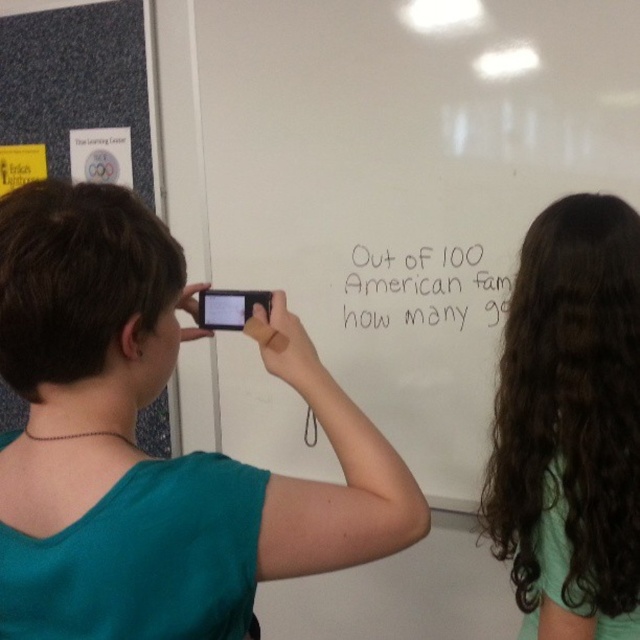
You are a photographer positioned in front of the whiteboard. You need to capture a clear image of the text on the whiteboard while also including the person with dark brown curly hair at upper right in the frame. Given their distance from you, will you need to adjust your camera angle to include both the text and the person?

The dark brown curly hair at upper right is 38.17 inches from the viewer. To capture both the text on the whiteboard and the person with dark brown curly hair at upper right in the same frame, you would need to adjust your camera angle or position since the person is relatively close to the viewer compared to the whiteboard text, which is further away. This adjustment ensures both elements are in focus and visible.

You are a student in the classroom and want to see both the blue fabric bulletin board at upper left and the black handwritten text at center clearly. Can you move to a position where you can see both without obstruction?

The blue fabric bulletin board at upper left is positioned over the black handwritten text at center, so you cannot see both clearly at the same time because the bulletin board is blocking the view of the text below it.